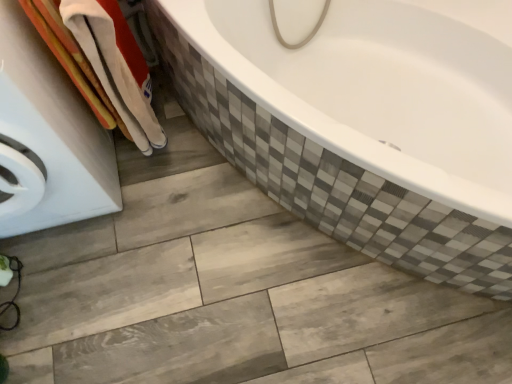
Where is `free location to the right of white glossy washing machine at left`? Image resolution: width=512 pixels, height=384 pixels. free location to the right of white glossy washing machine at left is located at coordinates (183, 200).